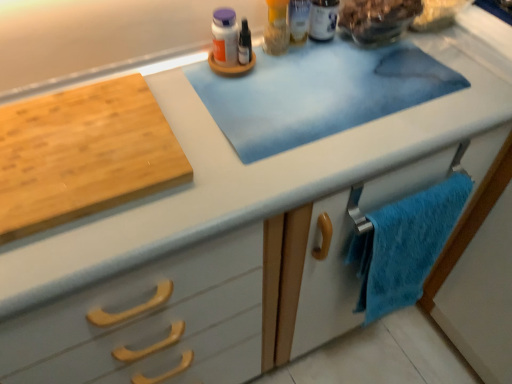
Where is `vacant area on top of natural wood cutting board at left (from a real-world perspective)`? Image resolution: width=512 pixels, height=384 pixels. vacant area on top of natural wood cutting board at left (from a real-world perspective) is located at coordinates (67, 142).